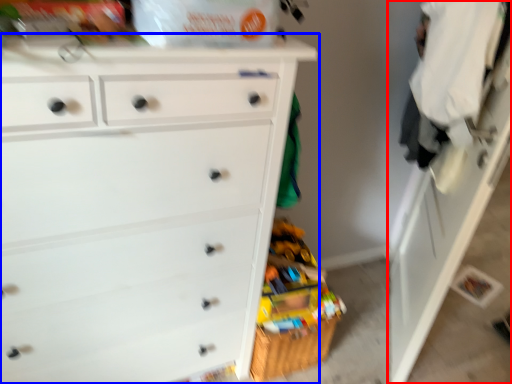
Question: Which of the following is the closest to the observer, dresser (highlighted by a red box) or chest of drawers (highlighted by a blue box)?

Choices:
 (A) dresser
 (B) chest of drawers

Answer: (B)